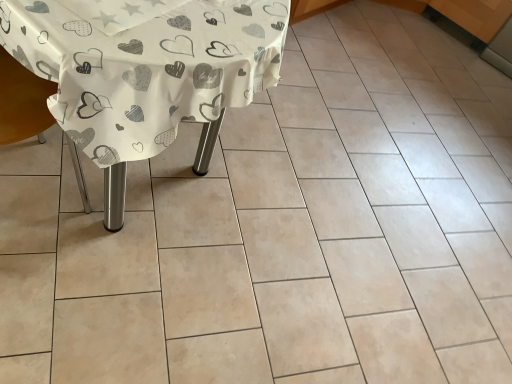
The width and height of the screenshot is (512, 384). I want to click on wooden armchair at left, so click(x=22, y=102).

The width and height of the screenshot is (512, 384). Describe the element at coordinates (22, 102) in the screenshot. I see `wooden armchair at left` at that location.

What is the approximate width of white paper with heart patterns at center?

30.46 inches.

Locate an element on the screen. Image resolution: width=512 pixels, height=384 pixels. white paper with heart patterns at center is located at coordinates (145, 71).

What do you see at coordinates (145, 71) in the screenshot?
I see `white paper with heart patterns at center` at bounding box center [145, 71].

Find the location of a particular element. wooden armchair at left is located at coordinates (22, 102).

Which object is positioned more to the right, wooden armchair at left or white paper with heart patterns at center?

white paper with heart patterns at center.

Is wooden armchair at left positioned in front of white paper with heart patterns at center?

Yes.

Is point (23, 103) in front of point (139, 145)?

No.

From the image's perspective, is wooden armchair at left above or below white paper with heart patterns at center?

Clearly, from the image's perspective, wooden armchair at left is below white paper with heart patterns at center.

From a real-world perspective, which object rests below the other?

wooden armchair at left.

Looking at this image, does wooden armchair at left have a lesser width compared to white paper with heart patterns at center?

Yes, wooden armchair at left is thinner than white paper with heart patterns at center.

Between wooden armchair at left and white paper with heart patterns at center, which one has more height?

With more height is wooden armchair at left.

Which of these two, wooden armchair at left or white paper with heart patterns at center, is smaller?

With smaller size is wooden armchair at left.

In the scene shown: Is wooden armchair at left situated inside white paper with heart patterns at center or outside?

wooden armchair at left exists outside the volume of white paper with heart patterns at center.

Is wooden armchair at left beside white paper with heart patterns at center?

No, wooden armchair at left is not touching white paper with heart patterns at center.

Based on the photo, is wooden armchair at left oriented towards white paper with heart patterns at center?

Yes, wooden armchair at left faces towards white paper with heart patterns at center.

How different are the orientations of wooden armchair at left and white paper with heart patterns at center in degrees?

The angle between the facing direction of wooden armchair at left and the facing direction of white paper with heart patterns at center is 180 degrees.

How much distance is there between wooden armchair at left and white paper with heart patterns at center?

wooden armchair at left is 12.73 inches away from white paper with heart patterns at center.

Locate an element on the screen. The width and height of the screenshot is (512, 384). armchair on the left of white paper with heart patterns at center is located at coordinates (22, 102).

Based on their positions, is white paper with heart patterns at center located to the left or right of wooden armchair at left?

Clearly, white paper with heart patterns at center is on the right of wooden armchair at left in the image.

Is white paper with heart patterns at center behind wooden armchair at left?

Yes, it is behind wooden armchair at left.

Is point (57, 79) positioned in front of point (44, 126)?

Yes, it is in front of point (44, 126).

From the image's perspective, is white paper with heart patterns at center positioned above or below wooden armchair at left?

From the image's perspective, white paper with heart patterns at center appears above wooden armchair at left.

From a real-world perspective, is white paper with heart patterns at center physically located above or below wooden armchair at left?

white paper with heart patterns at center is situated higher than wooden armchair at left in the real world.

Between white paper with heart patterns at center and wooden armchair at left, which one has larger width?

white paper with heart patterns at center.

Does white paper with heart patterns at center have a greater height compared to wooden armchair at left?

No.

Consider the image. In terms of size, does white paper with heart patterns at center appear bigger or smaller than wooden armchair at left?

Considering their sizes, white paper with heart patterns at center takes up more space than wooden armchair at left.

Is white paper with heart patterns at center not inside wooden armchair at left?

Yes.

Looking at this image, are white paper with heart patterns at center and wooden armchair at left making contact?

No.

Is white paper with heart patterns at center looking in the opposite direction of wooden armchair at left?

No.

Image resolution: width=512 pixels, height=384 pixels. In order to click on table that is above the wooden armchair at left (from a real-world perspective) in this screenshot , I will do `click(145, 71)`.

Where is `table on the right side of wooden armchair at left`? This screenshot has width=512, height=384. table on the right side of wooden armchair at left is located at coordinates (145, 71).

Locate an element on the screen. The width and height of the screenshot is (512, 384). armchair below the white paper with heart patterns at center (from a real-world perspective) is located at coordinates (22, 102).